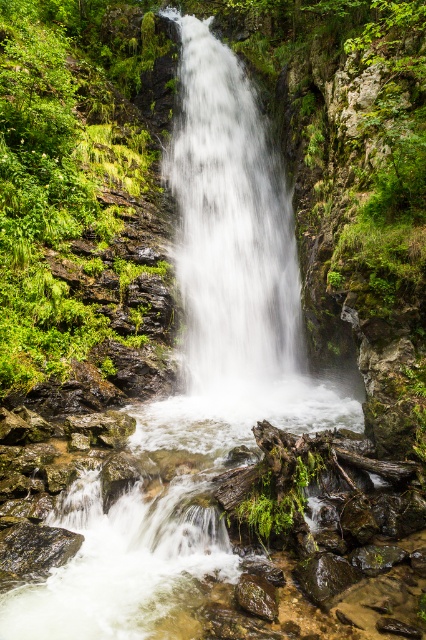
You are a photographer trying to capture the waterfall scene. You want to ensure that both the white frothy water at center and the smooth brown rock at lower center are clearly visible in your shot. Based on their sizes, which one should you focus on first to ensure proper exposure?

The white frothy water at center is bigger than the smooth brown rock at lower center, so you should focus on the white frothy water at center first to ensure proper exposure since it occupies more of the frame.

You are a photographer planning to capture the white frothy water at center. Based on the scene description, where should you position your camera to ensure it is centered in your shot?

To center the white frothy water at center in your shot, position your camera at point 0.356 on the x axis and 0.540 on the y axis, as this is the exact coordinate where the white frothy water at center is located.